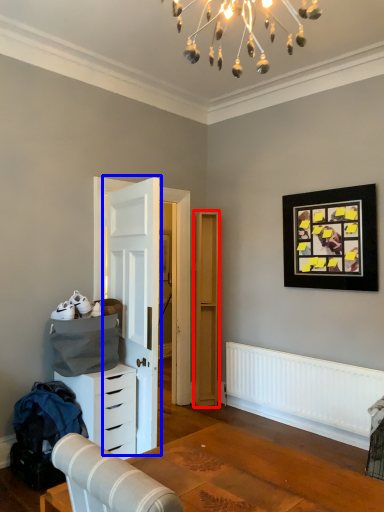
Question: Which object appears closest to the camera in this image, file cabinet (highlighted by a red box) or door (highlighted by a blue box)?

Choices:
 (A) file cabinet
 (B) door

Answer: (B)